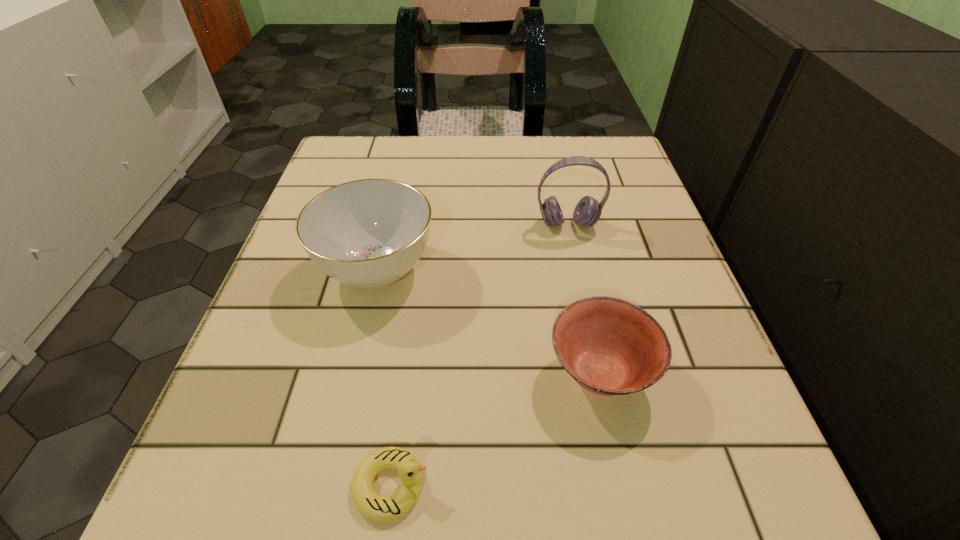
Locate an element on the screen. free space at the near right corner is located at coordinates (680, 469).

I want to click on unoccupied position between the headset and the bowl, so click(x=584, y=299).

Image resolution: width=960 pixels, height=540 pixels. Find the location of `vacant point located between the headset and the second shortest object`. vacant point located between the headset and the second shortest object is located at coordinates (584, 299).

Where is `vacant space that's between the nearest object and the second nearest object`? vacant space that's between the nearest object and the second nearest object is located at coordinates (495, 429).

Where is `vacant area between the tallest object and the nearest object`? vacant area between the tallest object and the nearest object is located at coordinates (480, 354).

Find the location of a particular element. The height and width of the screenshot is (540, 960). free area in between the tallest object and the shortest object is located at coordinates (480, 354).

The height and width of the screenshot is (540, 960). I want to click on free spot between the third shortest object and the second nearest object, so coord(489,321).

Locate an element on the screen. The width and height of the screenshot is (960, 540). free space between the second shortest object and the duckling is located at coordinates (495, 429).

I want to click on free space that is in between the chinaware and the bowl, so click(x=489, y=321).

This screenshot has height=540, width=960. What are the coordinates of `free space between the bowl and the tallest object` in the screenshot? It's located at (584, 299).